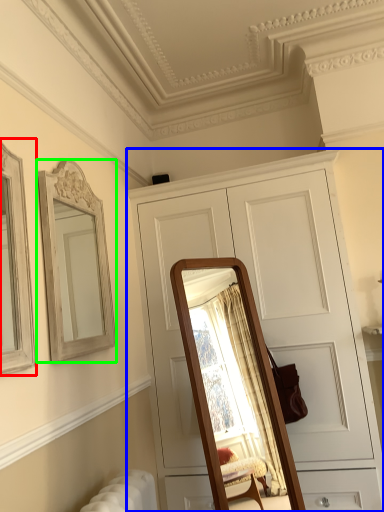
Question: Considering the real-world distances, which object is farthest from picture frame (highlighted by a red box)? cabinetry (highlighted by a blue box) or mirror (highlighted by a green box)?

Choices:
 (A) cabinetry
 (B) mirror

Answer: (A)